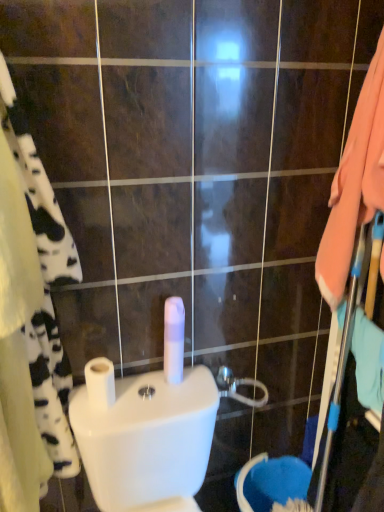
What do you see at coordinates (100, 383) in the screenshot? I see `white matte toilet paper at center, marked as the 1th toilet paper in a left-to-right arrangement` at bounding box center [100, 383].

What do you see at coordinates (238, 386) in the screenshot? Image resolution: width=384 pixels, height=512 pixels. I see `metallic silver showerhead at center` at bounding box center [238, 386].

Measure the distance between point (136, 423) and camera.

1.03 meters.

Find the location of `white matte toilet paper at center, the 2th toilet paper viewed from the right`. white matte toilet paper at center, the 2th toilet paper viewed from the right is located at coordinates (100, 383).

Considering the positions of objects white matte toilet paper at center, the second toilet paper from the left, and white glossy toilet bowl at center in the image provided, who is more to the right, white matte toilet paper at center, the second toilet paper from the left, or white glossy toilet bowl at center?

Positioned to the right is white matte toilet paper at center, the second toilet paper from the left.

Can we say white matte toilet paper at center, the second toilet paper from the left, lies outside white glossy toilet bowl at center?

Yes, white matte toilet paper at center, the second toilet paper from the left, is not within white glossy toilet bowl at center.

Is white matte toilet paper at center, acting as the first toilet paper starting from the right, oriented away from white glossy toilet bowl at center?

No, white matte toilet paper at center, acting as the first toilet paper starting from the right, is not facing away from white glossy toilet bowl at center.

Where is `toilet bowl that appears below the white matte toilet paper at center, acting as the first toilet paper starting from the right (from the image's perspective)`? toilet bowl that appears below the white matte toilet paper at center, acting as the first toilet paper starting from the right (from the image's perspective) is located at coordinates (147, 439).

Between point (90, 384) and point (228, 389), which one is positioned in front?

The point (90, 384) is in front.

Which of these two, white matte toilet paper at center, the 2th toilet paper viewed from the right, or metallic silver showerhead at center, is thinner?

Thinner between the two is metallic silver showerhead at center.

From a real-world perspective, is white matte toilet paper at center, the 2th toilet paper viewed from the right, above or below metallic silver showerhead at center?

In terms of real-world spatial position, white matte toilet paper at center, the 2th toilet paper viewed from the right, is above metallic silver showerhead at center.

From the picture: Is white matte toilet paper at center, marked as the 1th toilet paper in a left-to-right arrangement, taller or shorter than metallic silver showerhead at center?

white matte toilet paper at center, marked as the 1th toilet paper in a left-to-right arrangement, is taller than metallic silver showerhead at center.

Which of these two, white glossy toilet bowl at center or white matte toilet paper at center, the 2th toilet paper viewed from the right, is thinner?

white matte toilet paper at center, the 2th toilet paper viewed from the right, is thinner.

Identify the location of the 1st toilet paper positioned above the white glossy toilet bowl at center (from a real-world perspective). The height and width of the screenshot is (512, 384). (100, 383).

In the scene shown: From a real-world perspective, is white glossy toilet bowl at center over white matte toilet paper at center, the 2th toilet paper viewed from the right?

No, from a real-world perspective, white glossy toilet bowl at center is not over white matte toilet paper at center, the 2th toilet paper viewed from the right

Based on the photo, is white glossy toilet bowl at center next to white matte toilet paper at center, the 2th toilet paper viewed from the right, and touching it?

No, white glossy toilet bowl at center is not making contact with white matte toilet paper at center, the 2th toilet paper viewed from the right.

The image size is (384, 512). Find the location of `bath towel on the left of the white glossy toilet bowl at center`. bath towel on the left of the white glossy toilet bowl at center is located at coordinates (44, 287).

From the image's perspective, relative to white cotton bath towel at left, is white glossy toilet bowl at center above or below?

white glossy toilet bowl at center is situated lower than white cotton bath towel at left in the image.

Considering the relative sizes of white glossy toilet bowl at center and white cotton bath towel at left in the image provided, is white glossy toilet bowl at center taller than white cotton bath towel at left?

In fact, white glossy toilet bowl at center may be shorter than white cotton bath towel at left.

Is there a large distance between white glossy toilet bowl at center and white cotton bath towel at left?

That's not correct — white glossy toilet bowl at center is a little close to white cotton bath towel at left.

Between white matte toilet paper at center, marked as the 1th toilet paper in a left-to-right arrangement, and white glossy toilet bowl at center, which one has less height?

With less height is white matte toilet paper at center, marked as the 1th toilet paper in a left-to-right arrangement.

Is there a large distance between white matte toilet paper at center, the 2th toilet paper viewed from the right, and white glossy toilet bowl at center?

No, white matte toilet paper at center, the 2th toilet paper viewed from the right, is not far away from white glossy toilet bowl at center.

Is white matte toilet paper at center, the 2th toilet paper viewed from the right, situated inside white glossy toilet bowl at center or outside?

white matte toilet paper at center, the 2th toilet paper viewed from the right, is located beyond the bounds of white glossy toilet bowl at center.

Is white matte toilet paper at center, the 2th toilet paper viewed from the right, further to the viewer compared to white glossy toilet bowl at center?

Yes, it is behind white glossy toilet bowl at center.

From the picture: From a real-world perspective, which object rests below the other?

In real-world perspective, metallic silver showerhead at center is lower.

Which is behind, metallic silver showerhead at center or white cotton bath towel at left?

metallic silver showerhead at center.

Is metallic silver showerhead at center spatially inside white cotton bath towel at left, or outside of it?

metallic silver showerhead at center is not enclosed by white cotton bath towel at left.

Considering the sizes of objects metallic silver showerhead at center and white cotton bath towel at left in the image provided, who is shorter, metallic silver showerhead at center or white cotton bath towel at left?

Standing shorter between the two is metallic silver showerhead at center.

Between white cotton bath towel at left and white glossy toilet bowl at center, which one has more height?

With more height is white cotton bath towel at left.

Between white cotton bath towel at left and white glossy toilet bowl at center, which one is positioned behind?

Positioned behind is white glossy toilet bowl at center.

Based on the photo, is white cotton bath towel at left spatially inside white glossy toilet bowl at center, or outside of it?

white cotton bath towel at left is spatially situated outside white glossy toilet bowl at center.

Which object is thinner, white cotton bath towel at left or white glossy toilet bowl at center?

white cotton bath towel at left is thinner.

Find the location of `toilet paper that appears on the right of white glossy toilet bowl at center`. toilet paper that appears on the right of white glossy toilet bowl at center is located at coordinates (174, 339).

Image resolution: width=384 pixels, height=512 pixels. In order to click on shower below the white matte toilet paper at center, marked as the 1th toilet paper in a left-to-right arrangement (from a real-world perspective) in this screenshot , I will do pos(238,386).

When comparing their distances from metallic silver showerhead at center, does white glossy toilet bowl at center or white cotton bath towel at left seem further?

The object further to metallic silver showerhead at center is white cotton bath towel at left.

Which object lies further to the anchor point white matte toilet paper at center, marked as the 1th toilet paper in a left-to-right arrangement, white glossy toilet bowl at center or metallic silver showerhead at center?

Based on the image, metallic silver showerhead at center appears to be further to white matte toilet paper at center, marked as the 1th toilet paper in a left-to-right arrangement.

Considering their positions, is white cotton bath towel at left positioned closer to white matte toilet paper at center, acting as the first toilet paper starting from the right, than white glossy toilet bowl at center?

white glossy toilet bowl at center lies closer to white matte toilet paper at center, acting as the first toilet paper starting from the right, than the other object.

Which object lies nearer to the anchor point white matte toilet paper at center, the second toilet paper from the left, white cotton bath towel at left or white matte toilet paper at center, the 2th toilet paper viewed from the right?

The object closer to white matte toilet paper at center, the second toilet paper from the left, is white matte toilet paper at center, the 2th toilet paper viewed from the right.

Which object lies nearer to the anchor point metallic silver showerhead at center, white glossy toilet bowl at center or white matte toilet paper at center, the second toilet paper from the left?

white matte toilet paper at center, the second toilet paper from the left.

Based on the photo, which object lies nearer to the anchor point white matte toilet paper at center, the 2th toilet paper viewed from the right, white glossy toilet bowl at center or white matte toilet paper at center, the second toilet paper from the left?

white glossy toilet bowl at center is positioned closer to the anchor white matte toilet paper at center, the 2th toilet paper viewed from the right.

Considering their positions, is white glossy toilet bowl at center positioned closer to white cotton bath towel at left than white matte toilet paper at center, marked as the 1th toilet paper in a left-to-right arrangement?

Based on the image, white matte toilet paper at center, marked as the 1th toilet paper in a left-to-right arrangement, appears to be nearer to white cotton bath towel at left.

Looking at the image, which one is located closer to white cotton bath towel at left, white matte toilet paper at center, the second toilet paper from the left, or white glossy toilet bowl at center?

white glossy toilet bowl at center is closer to white cotton bath towel at left.

Where is `toilet paper positioned between white cotton bath towel at left and white matte toilet paper at center, the second toilet paper from the left, from near to far`? Image resolution: width=384 pixels, height=512 pixels. toilet paper positioned between white cotton bath towel at left and white matte toilet paper at center, the second toilet paper from the left, from near to far is located at coordinates (100, 383).

The height and width of the screenshot is (512, 384). I want to click on shower that lies between white matte toilet paper at center, the second toilet paper from the left, and white glossy toilet bowl at center from top to bottom, so click(x=238, y=386).

You are a GUI agent. You are given a task and a screenshot of the screen. Output one action in this format:
    pyautogui.click(x=<x>, y=<y>)
    Task: Click on the toilet paper between white matte toilet paper at center, marked as the 1th toilet paper in a left-to-right arrangement, and metallic silver showerhead at center from left to right
    The width and height of the screenshot is (384, 512).
    Given the screenshot: What is the action you would take?
    pyautogui.click(x=174, y=339)

This screenshot has width=384, height=512. I want to click on toilet bowl between white cotton bath towel at left and metallic silver showerhead at center along the z-axis, so click(x=147, y=439).